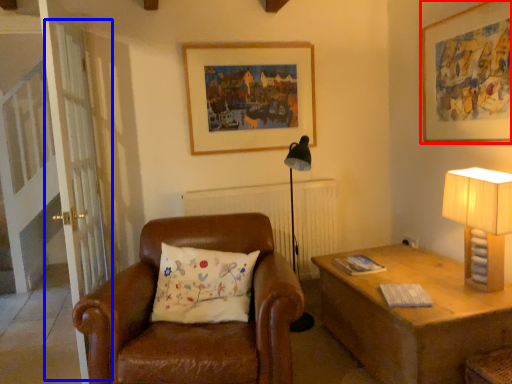
Question: Which object is further to the camera taking this photo, picture frame (highlighted by a red box) or screen door (highlighted by a blue box)?

Choices:
 (A) picture frame
 (B) screen door

Answer: (B)